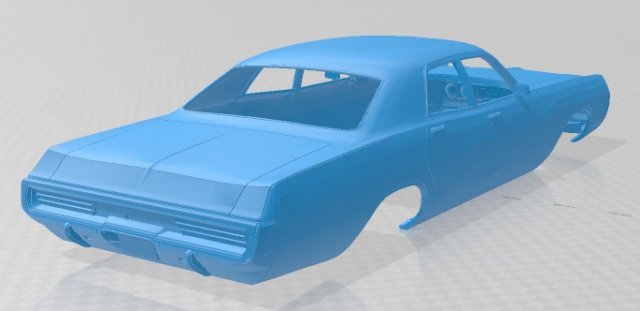
This screenshot has height=311, width=640. In order to click on window in this screenshot , I will do `click(486, 80)`, `click(447, 85)`.